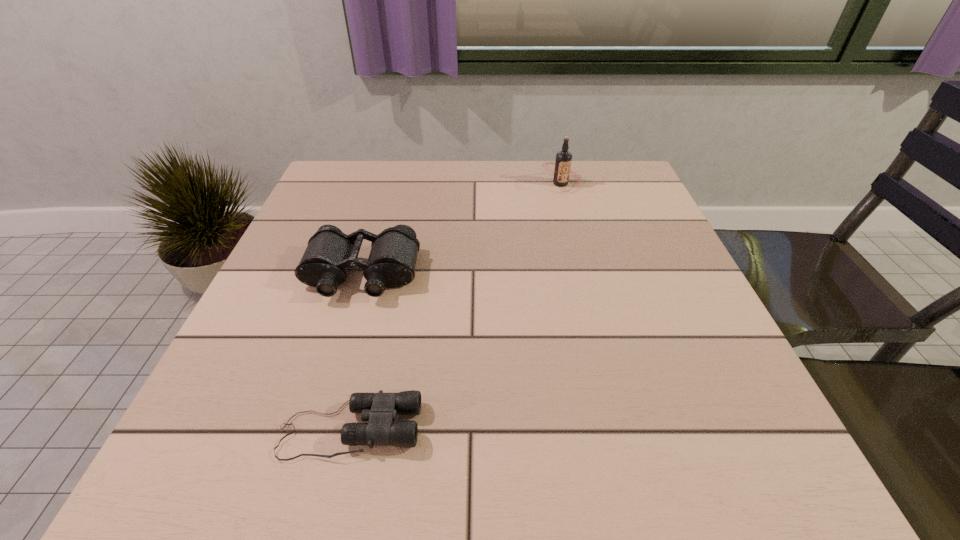
Image resolution: width=960 pixels, height=540 pixels. I want to click on the rightmost object, so click(562, 171).

In order to click on the farthest object in this screenshot , I will do click(x=562, y=171).

Where is `the farther binoculars`? The image size is (960, 540). the farther binoculars is located at coordinates (330, 252).

You are a GUI agent. You are given a task and a screenshot of the screen. Output one action in this format:
    pyautogui.click(x=<x>, y=<y>)
    Task: Click on the taller binoculars
    The image size is (960, 540).
    Given the screenshot: What is the action you would take?
    pyautogui.click(x=330, y=252)

Find the location of a particular element. The image size is (960, 540). the shorter binoculars is located at coordinates pos(380,409).

Where is `the shortest object`? This screenshot has width=960, height=540. the shortest object is located at coordinates (380, 409).

Find the location of a particular element. free point located on the label of the tallest object is located at coordinates (567, 210).

Where is `vacant space situated through the eyepieces of the second nearest object`? The image size is (960, 540). vacant space situated through the eyepieces of the second nearest object is located at coordinates (315, 431).

The width and height of the screenshot is (960, 540). In order to click on vacant space situated 0.200m at the eyepiece of the nearest object in this screenshot , I will do `click(552, 429)`.

You are a GUI agent. You are given a task and a screenshot of the screen. Output one action in this format:
    pyautogui.click(x=<x>, y=<y>)
    Task: Click on the object present at the far edge
    The width and height of the screenshot is (960, 540).
    Given the screenshot: What is the action you would take?
    pyautogui.click(x=562, y=171)